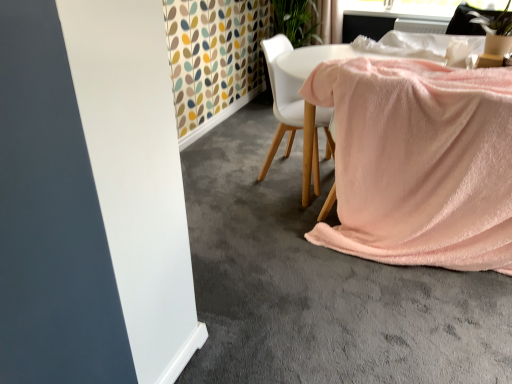
Find the location of a particular element. This screenshot has width=512, height=384. blank area to the left of pink soft fabric at center is located at coordinates (234, 201).